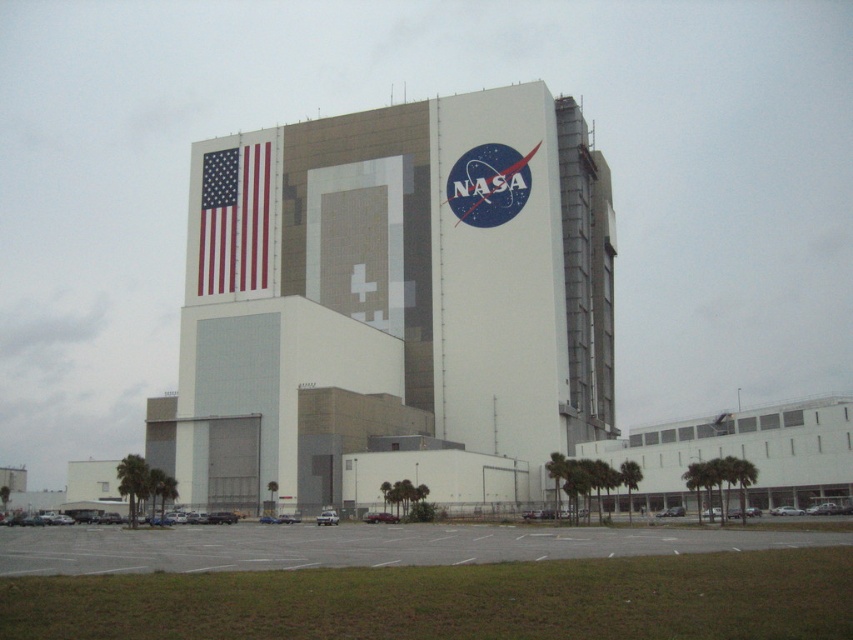
Question: Which point is farther to the camera?

Choices:
 (A) (219, 227)
 (B) (419, 371)

Answer: (A)

Question: Does white concrete building at center have a greater width compared to matte fabric flag at upper left?

Choices:
 (A) yes
 (B) no

Answer: (A)

Question: Which point is farther from the camera taking this photo?

Choices:
 (A) (236, 248)
 (B) (486, 333)

Answer: (A)

Question: Does white concrete building at center appear on the right side of matte fabric flag at upper left?

Choices:
 (A) yes
 (B) no

Answer: (A)

Question: Is white concrete building at center to the right of matte fabric flag at upper left from the viewer's perspective?

Choices:
 (A) no
 (B) yes

Answer: (B)

Question: Which of the following is the farthest from the observer?

Choices:
 (A) white concrete building at center
 (B) matte fabric flag at upper left

Answer: (B)